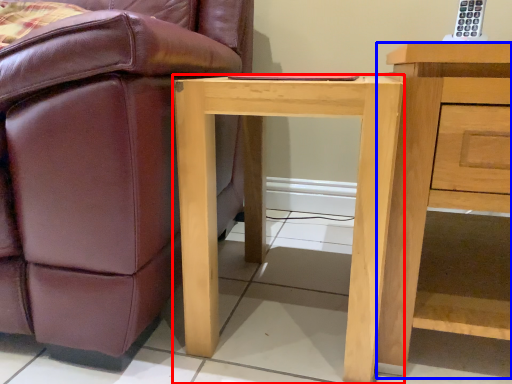
Question: Which object is further to the camera taking this photo, desk (highlighted by a red box) or nightstand (highlighted by a blue box)?

Choices:
 (A) desk
 (B) nightstand

Answer: (A)